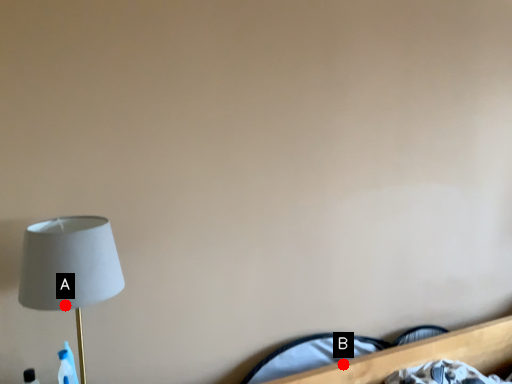
Question: Two points are circled on the image, labeled by A and B beside each circle. Which point is closer to the camera?

Choices:
 (A) A is closer
 (B) B is closer

Answer: (A)